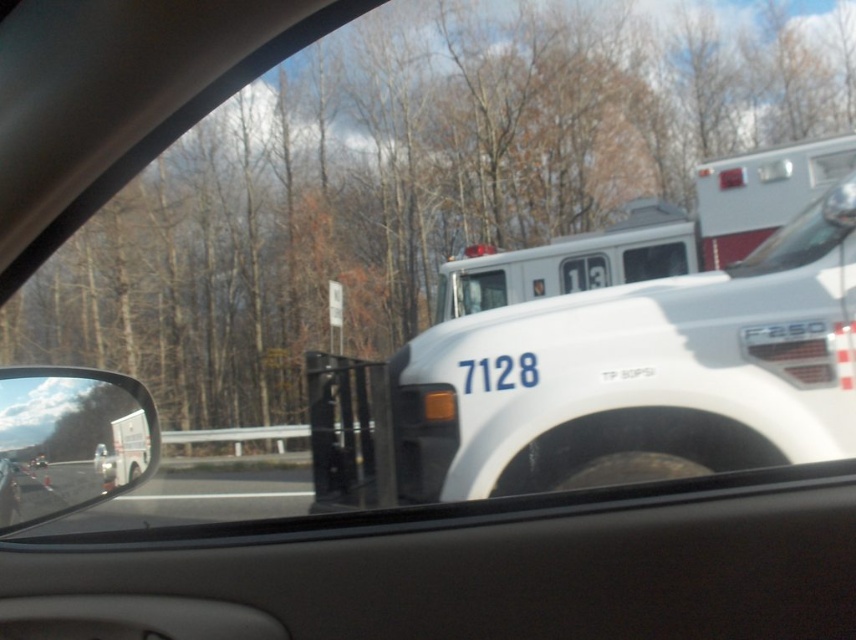
Question: Is white glossy fire truck at upper center to the left of white glossy truck at left from the viewer's perspective?

Choices:
 (A) yes
 (B) no

Answer: (B)

Question: Which is nearer to the white glossy fire truck at upper center?

Choices:
 (A) white glossy truck at left
 (B) clear glass windshield at upper right

Answer: (B)

Question: Which point is farther to the camera?

Choices:
 (A) (1, 416)
 (B) (842, 193)
 (C) (489, 305)

Answer: (C)

Question: Does white glossy fire truck at upper center have a lesser width compared to clear glass windshield at upper right?

Choices:
 (A) yes
 (B) no

Answer: (B)

Question: Which point is farther to the camera?

Choices:
 (A) (64, 465)
 (B) (777, 248)

Answer: (B)

Question: Can you confirm if white glossy fire truck at upper center is bigger than white glossy truck at left?

Choices:
 (A) no
 (B) yes

Answer: (A)